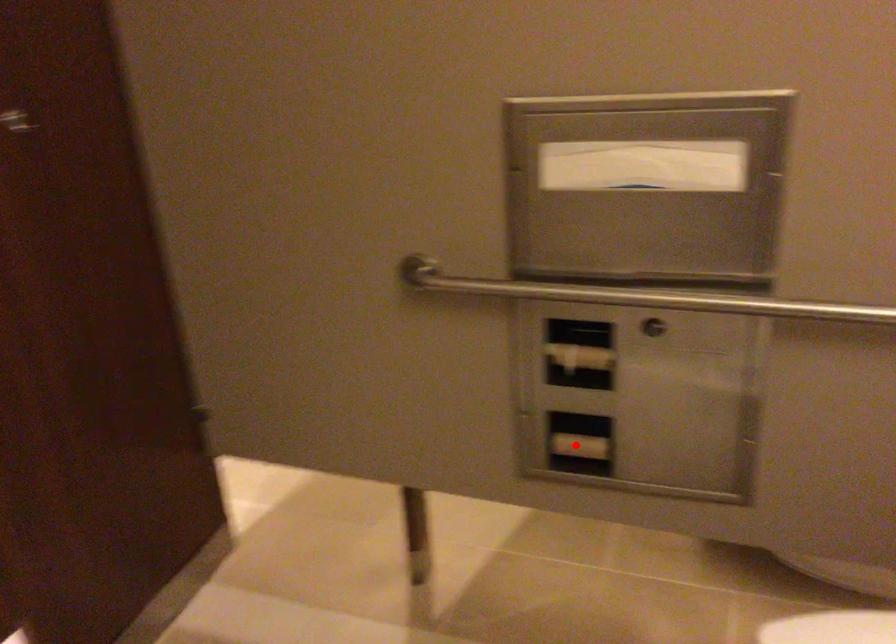
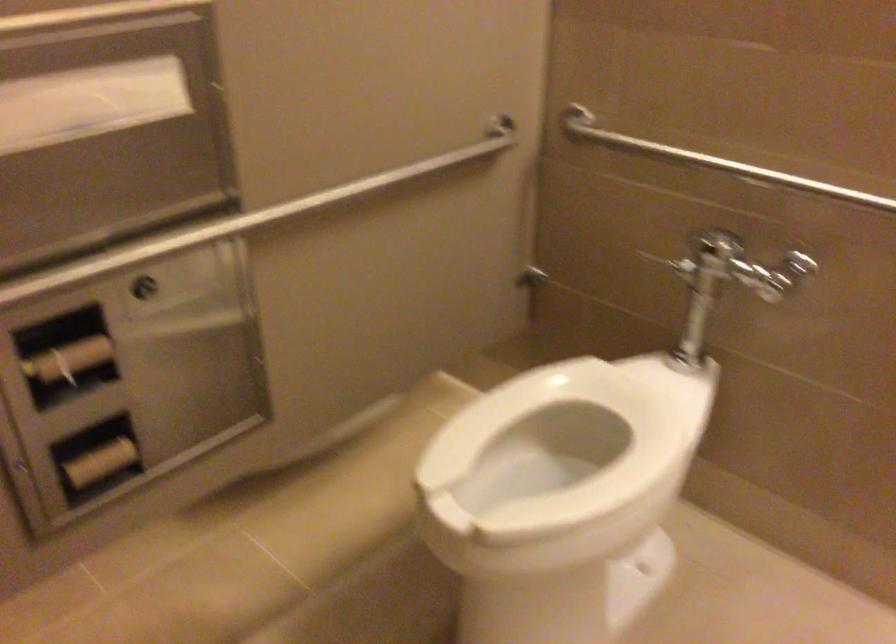
The point at the highlighted location is marked in the first image. Where is the corresponding point in the second image?

(99, 462)